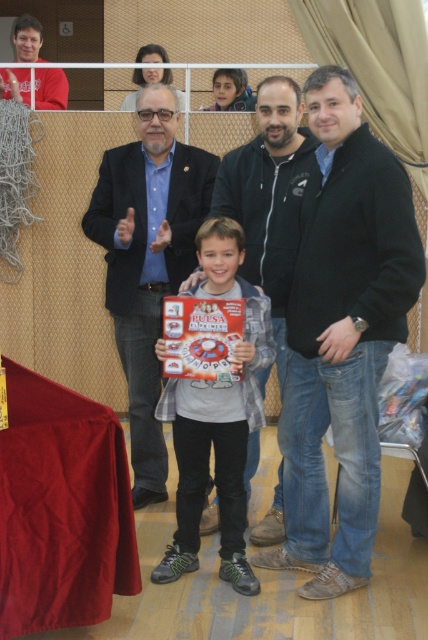
Does point (326, 397) come behind point (281, 99)?

That is False.

Which of these two, black matte jacket at center or black fleece jacket at center, stands shorter?

Standing shorter between the two is black fleece jacket at center.

Is point (324, 180) behind point (213, 522)?

No, (324, 180) is in front of (213, 522).

Identify the location of black matte jacket at center. (341, 337).

Where is `matte plastic board game at center`? Image resolution: width=428 pixels, height=640 pixels. matte plastic board game at center is located at coordinates (216, 419).

Looking at this image, can you confirm if matte plastic board game at center is taller than black fleece jacket at center?

Indeed, matte plastic board game at center has a greater height compared to black fleece jacket at center.

Does point (160, 408) come farther from viewer compared to point (265, 140)?

No, (160, 408) is in front of (265, 140).

Image resolution: width=428 pixels, height=640 pixels. I want to click on matte plastic board game at center, so click(x=216, y=419).

How distant is black matte jacket at center from matte plastic board game at center?

22.59 inches

Does black matte jacket at center have a lesser height compared to matte plastic board game at center?

No, black matte jacket at center is not shorter than matte plastic board game at center.

The width and height of the screenshot is (428, 640). I want to click on black matte jacket at center, so click(341, 337).